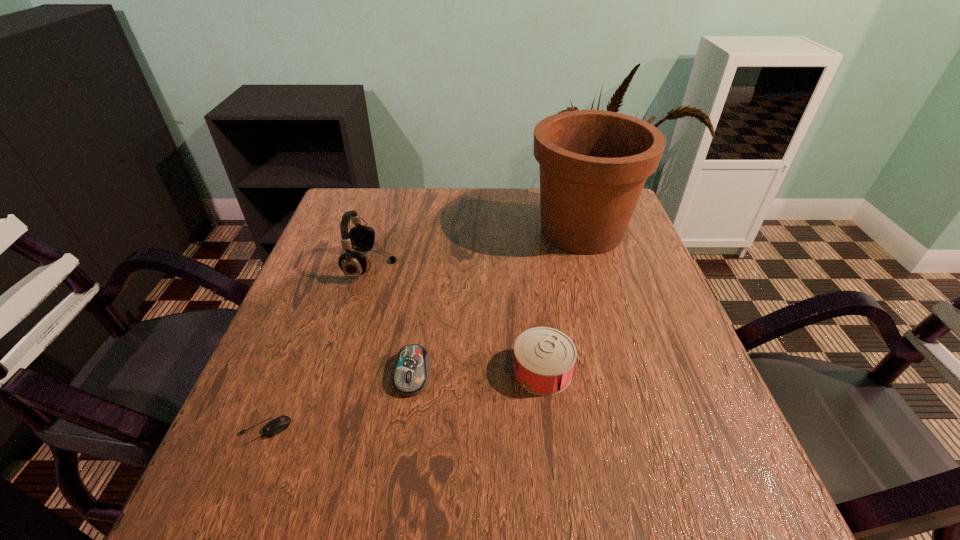
The width and height of the screenshot is (960, 540). Find the location of `vacant space at the right edge of the desktop`. vacant space at the right edge of the desktop is located at coordinates (673, 350).

You are a GUI agent. You are given a task and a screenshot of the screen. Output one action in this format:
    pyautogui.click(x=<x>, y=<y>)
    Task: Click on the free spot between the third tallest object and the headset
    This screenshot has width=960, height=540.
    Given the screenshot: What is the action you would take?
    pyautogui.click(x=457, y=318)

I want to click on free space between the can and the right mouse, so click(x=477, y=372).

The height and width of the screenshot is (540, 960). What are the coordinates of `vacant area between the can and the second shortest object` in the screenshot? It's located at (477, 372).

Image resolution: width=960 pixels, height=540 pixels. Find the location of `vacant point located between the second tallest object and the can`. vacant point located between the second tallest object and the can is located at coordinates (457, 318).

Image resolution: width=960 pixels, height=540 pixels. Find the location of `free spot between the can and the headset`. free spot between the can and the headset is located at coordinates (457, 318).

Identify the location of free spot between the right mouse and the shorter mouse. (338, 402).

The height and width of the screenshot is (540, 960). Find the location of `free area in between the second tallest object and the nearest object`. free area in between the second tallest object and the nearest object is located at coordinates (318, 348).

Where is `empty space between the tallest object and the nearer mouse`? The height and width of the screenshot is (540, 960). empty space between the tallest object and the nearer mouse is located at coordinates (423, 330).

The height and width of the screenshot is (540, 960). I want to click on empty space that is in between the second shortest object and the nearest object, so click(338, 402).